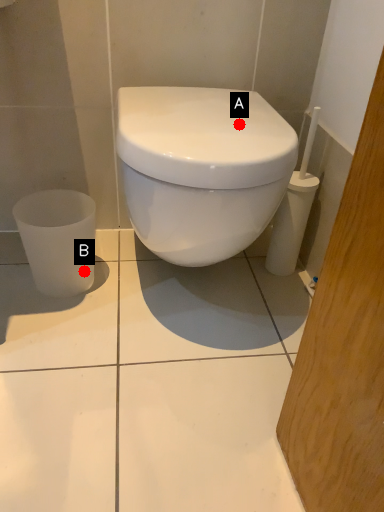
Question: Two points are circled on the image, labeled by A and B beside each circle. Which point appears farthest from the camera in this image?

Choices:
 (A) A is further
 (B) B is further

Answer: (B)